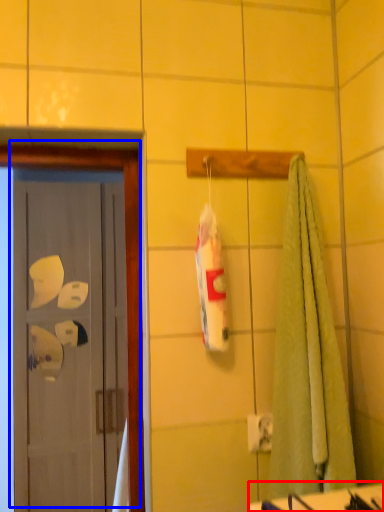
Question: Among these objects, which one is nearest to the camera, counter top (highlighted by a red box) or door (highlighted by a blue box)?

Choices:
 (A) counter top
 (B) door

Answer: (A)